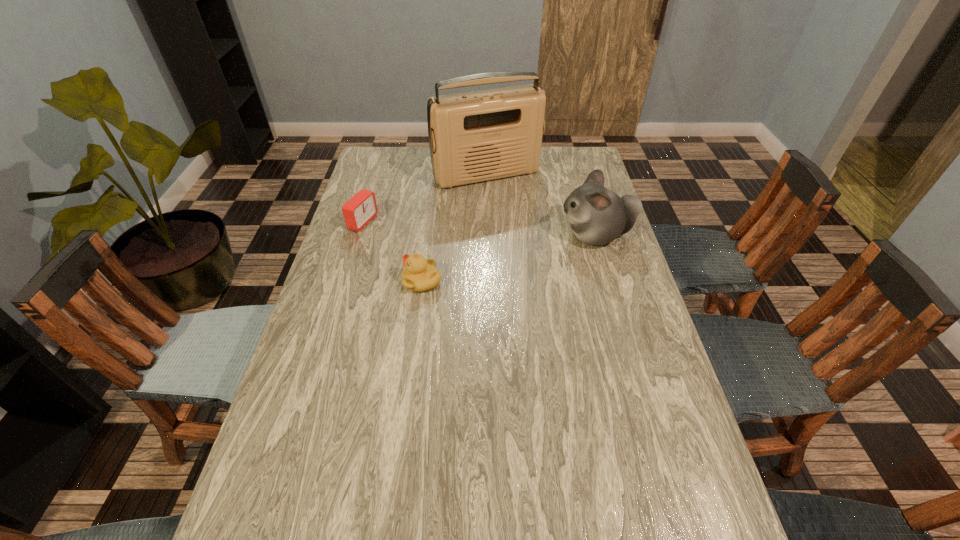
Locate an element on the screen. free space between the duckling and the leftmost object is located at coordinates (393, 252).

Locate an element on the screen. empty space between the nearest object and the alarm clock is located at coordinates (393, 252).

Identify the location of free area in between the rightmost object and the tallest object. The height and width of the screenshot is (540, 960). (541, 205).

The image size is (960, 540). In order to click on free space between the second tallest object and the alarm clock in this screenshot , I will do `click(479, 228)`.

Where is `unoccupied position between the duckling and the farthest object`? unoccupied position between the duckling and the farthest object is located at coordinates (454, 228).

Find the location of a particular element. The width and height of the screenshot is (960, 540). free spot between the tallest object and the alarm clock is located at coordinates (425, 198).

Identify which object is the third nearest to the third shortest object. Please provide its 2D coordinates. Your answer should be formatted as a tuple, i.e. [(x, y)], where the tuple contains the x and y coordinates of a point satisfying the conditions above.

[(361, 208)]

The width and height of the screenshot is (960, 540). In order to click on object that is the second nearest to the hamster in this screenshot , I will do `click(420, 274)`.

This screenshot has width=960, height=540. In order to click on vacant area in the image that satisfies the following two spatial constraints: 1. on the back side of the tallest object; 2. on the left side of the alarm clock in this screenshot , I will do `click(377, 174)`.